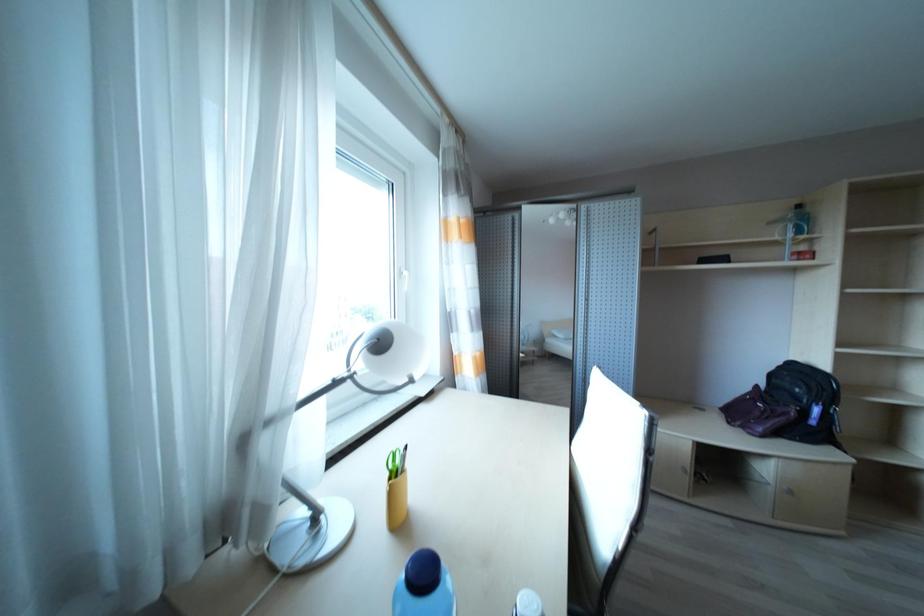
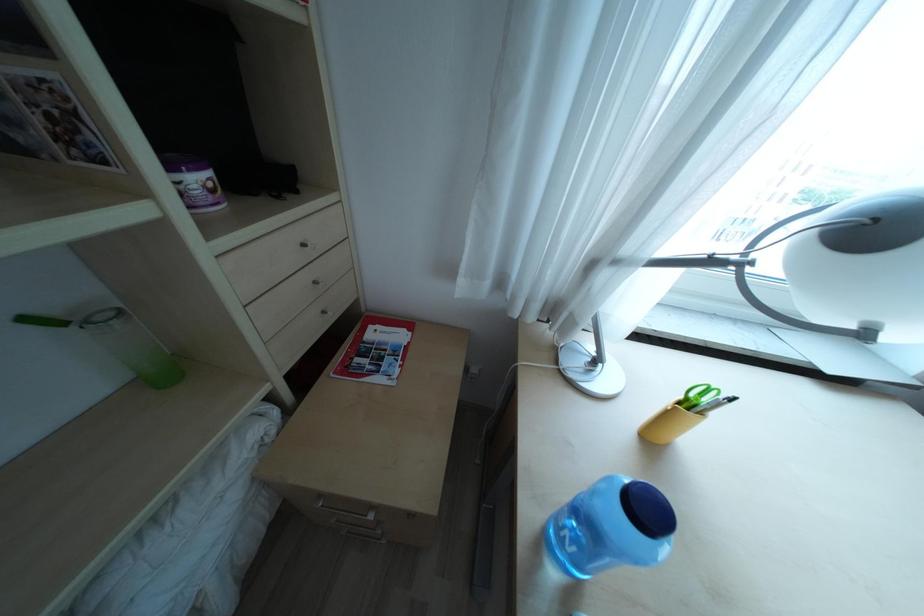
Based on the continuous images, in which direction is the camera rotating?

The rotation direction of the camera is left-down.